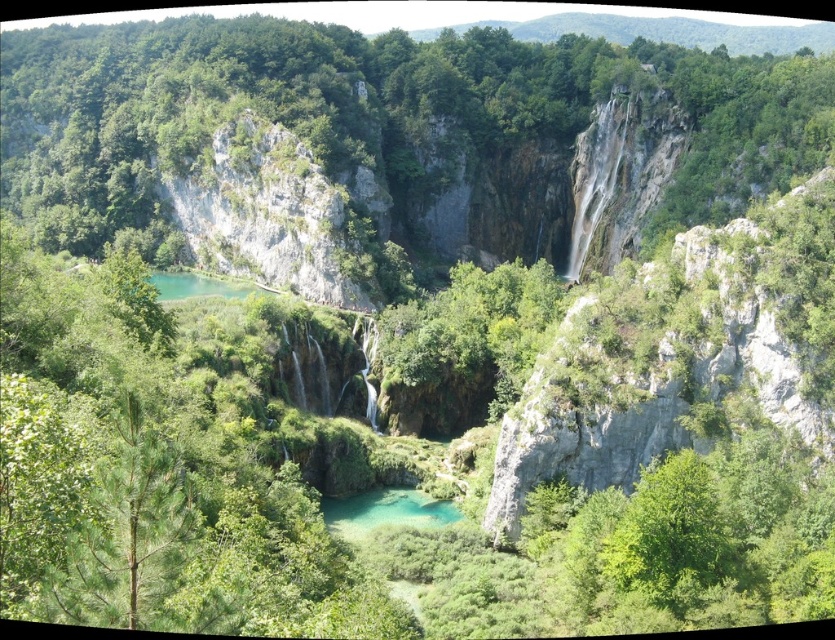
Question: Is green leafy tree at center closer to camera compared to turquoise glossy water at center?

Choices:
 (A) yes
 (B) no

Answer: (B)

Question: Based on their relative distances, which object is nearer to the turquoise glossy water at center?

Choices:
 (A) green leafy tree at center
 (B) green matte tree at left

Answer: (B)

Question: Does green leafy tree at center have a larger size compared to turquoise glossy water at center?

Choices:
 (A) no
 (B) yes

Answer: (B)

Question: Does green matte tree at left appear over turquoise glossy water at center?

Choices:
 (A) no
 (B) yes

Answer: (B)

Question: Which point is farther to the camera?

Choices:
 (A) (413, 493)
 (B) (550, 67)
 (C) (181, 461)

Answer: (B)

Question: Which of these objects is positioned closest to the turquoise glossy water at center?

Choices:
 (A) green matte tree at left
 (B) green leafy tree at center

Answer: (A)